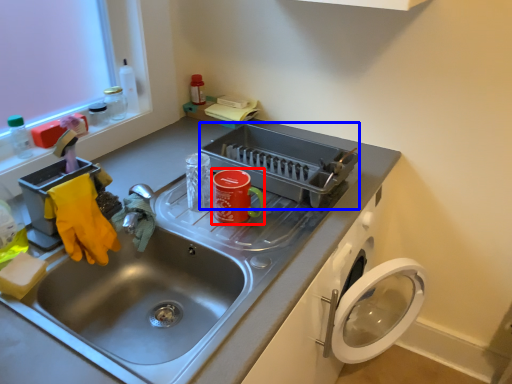
Question: Which object appears closest to the camera in this image, appliance (highlighted by a red box) or appliance (highlighted by a blue box)?

Choices:
 (A) appliance
 (B) appliance

Answer: (A)